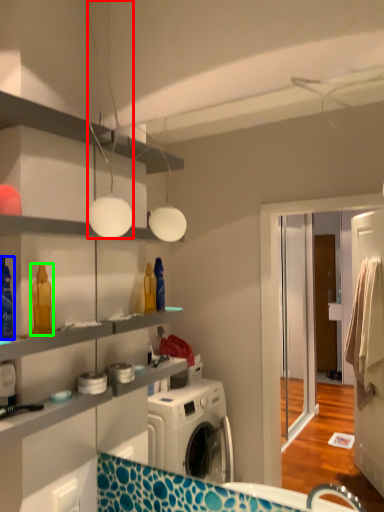
Question: Considering the real-world distances, which object is closest to light fixture (highlighted by a red box)? cleaning product (highlighted by a blue box) or cleaning product (highlighted by a green box).

Choices:
 (A) cleaning product
 (B) cleaning product

Answer: (B)